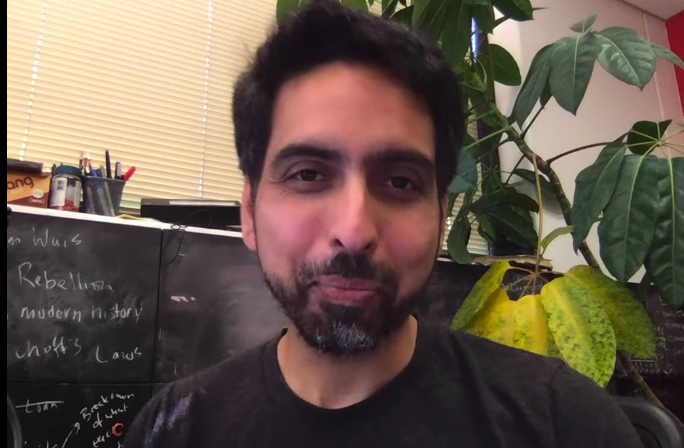
Identify the location of wall. (594, 120).